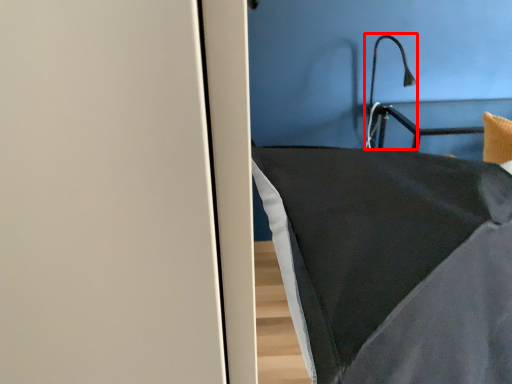
Question: From the image's perspective, where is light fixture (annotated by the red box) located relative to furniture?

Choices:
 (A) below
 (B) above

Answer: (B)